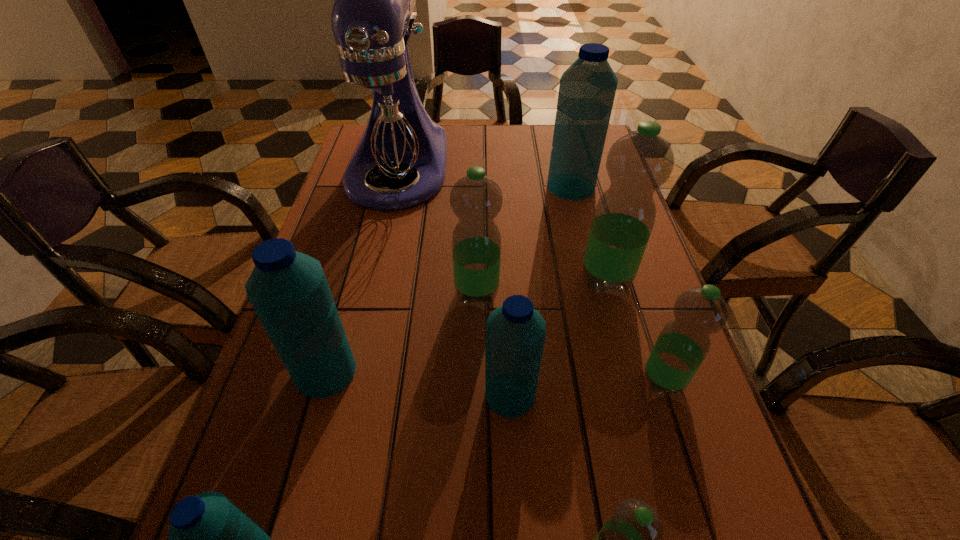
Where is `water bottle that stands as the second closest to the leftmost green water bottle`? This screenshot has height=540, width=960. water bottle that stands as the second closest to the leftmost green water bottle is located at coordinates (638, 163).

Select which blue water bottle is the second closest to the farthest water bottle. Please provide its 2D coordinates. Your answer should be formatted as a tuple, i.e. [(x, y)], where the tuple contains the x and y coordinates of a point satisfying the conditions above.

[(288, 290)]

You are a GUI agent. You are given a task and a screenshot of the screen. Output one action in this format:
    pyautogui.click(x=<x>, y=<y>)
    Task: Click on the blue water bottle that is the closest to the second biggest blue water bottle
    
    Given the screenshot: What is the action you would take?
    pyautogui.click(x=210, y=539)

Select which green water bottle is the fourth closest to the second biggest blue water bottle. Please provide its 2D coordinates. Your answer should be formatted as a tuple, i.e. [(x, y)], where the tuple contains the x and y coordinates of a point satisfying the conditions above.

[(683, 344)]

Find the location of a particular element. Image resolution: width=960 pixels, height=540 pixels. green water bottle that is the nearest to the leftmost green water bottle is located at coordinates (638, 163).

At what (x,y) coordinates should I click in order to perform the action: click on free space that satisfies the following two spatial constraints: 1. on the back side of the biggest green water bottle; 2. on the left side of the second biggest green water bottle. Please return your answer as a coordinate pair (x, y). The width and height of the screenshot is (960, 540). Looking at the image, I should click on (477, 279).

Locate an element on the screen. This screenshot has width=960, height=540. free space that satisfies the following two spatial constraints: 1. at the mixing area of the blue mixer; 2. on the left side of the biggest green water bottle is located at coordinates (372, 279).

Identify the location of free location that satisfies the following two spatial constraints: 1. on the front side of the second blue water bottle from right to left; 2. on the left side of the second biggest green water bottle. (476, 395).